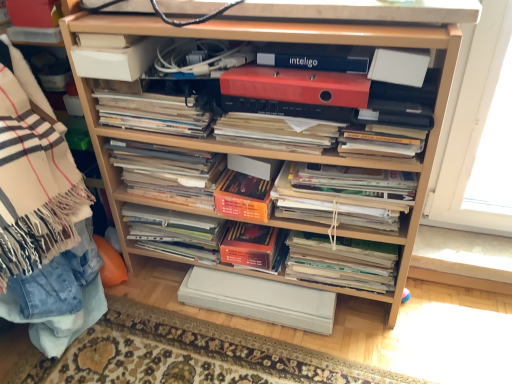
This screenshot has width=512, height=384. In order to click on free spot above matte orange paperback book at center, which appears as the 1th paperback book when ordered from the bottom (from a real-world perspective) in this screenshot , I will do `click(263, 289)`.